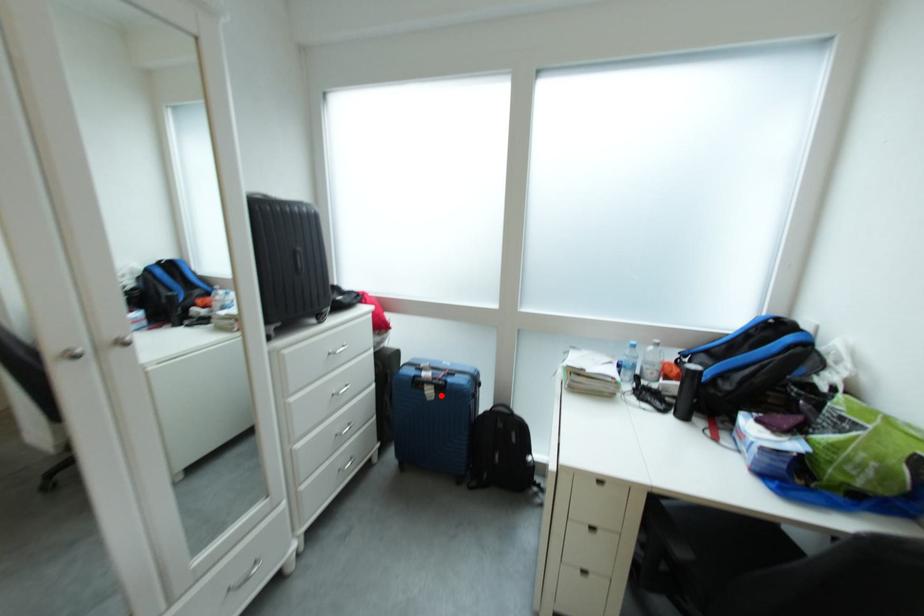
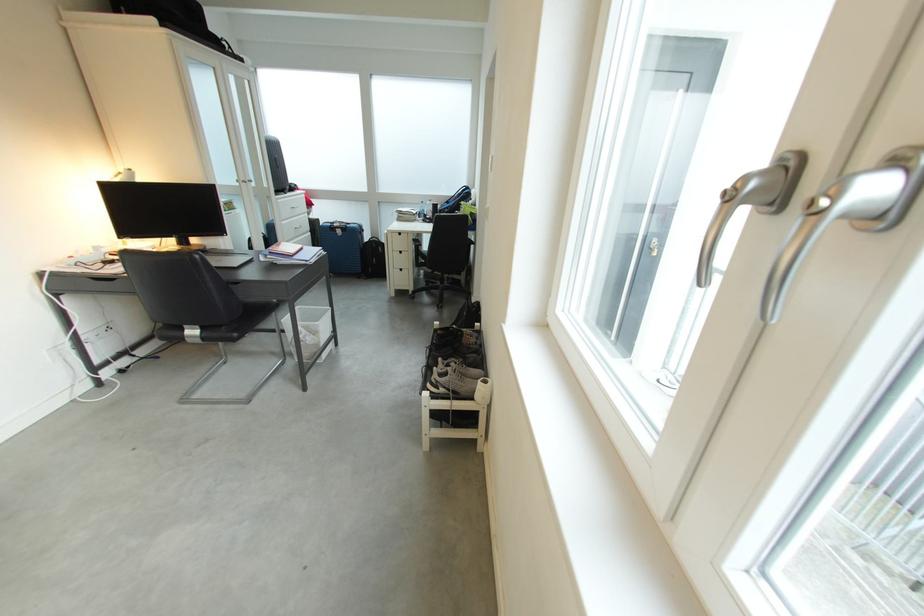
Where in the second image is the point corresponding to the highlighted location from the first image?

(350, 235)